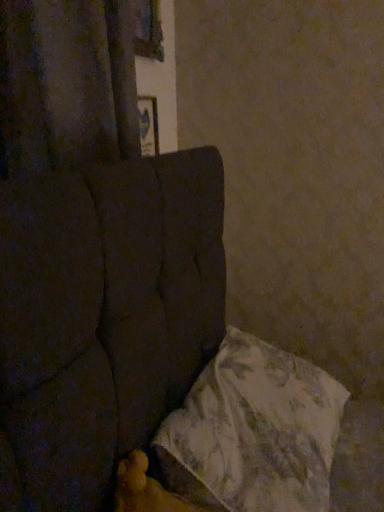
Question: Considering their positions, is fluffy white pillow at lower right located in front of or behind velvet dark brown curtain at upper left?

Choices:
 (A) front
 (B) behind

Answer: (A)

Question: Based on their positions, is fluffy white pillow at lower right located to the left or right of velvet dark brown curtain at upper left?

Choices:
 (A) left
 (B) right

Answer: (B)

Question: Considering the positions of fluffy white pillow at lower right and velvet dark brown curtain at upper left in the image, is fluffy white pillow at lower right wider or thinner than velvet dark brown curtain at upper left?

Choices:
 (A) wide
 (B) thin

Answer: (A)

Question: Looking at their shapes, would you say velvet dark brown curtain at upper left is wider or thinner than fluffy white pillow at lower right?

Choices:
 (A) wide
 (B) thin

Answer: (B)

Question: Considering the positions of velvet dark brown curtain at upper left and fluffy white pillow at lower right in the image, is velvet dark brown curtain at upper left bigger or smaller than fluffy white pillow at lower right?

Choices:
 (A) small
 (B) big

Answer: (A)

Question: From the image's perspective, is velvet dark brown curtain at upper left above or below fluffy white pillow at lower right?

Choices:
 (A) above
 (B) below

Answer: (A)

Question: Considering the positions of point (56, 45) and point (292, 403), is point (56, 45) closer or farther from the camera than point (292, 403)?

Choices:
 (A) closer
 (B) farther

Answer: (A)